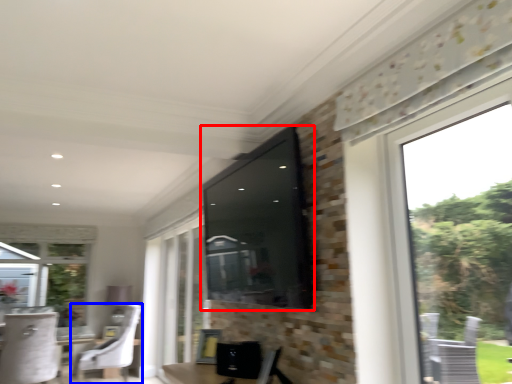
Question: Among these objects, which one is nearest to the camera, window screen (highlighted by a red box) or chair (highlighted by a blue box)?

Choices:
 (A) window screen
 (B) chair

Answer: (A)